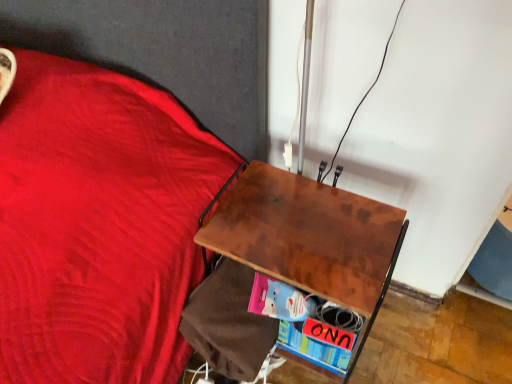
Question: From the image's perspective, is brown wood desk at center located beneath multicolored cardboard book at lower right?

Choices:
 (A) no
 (B) yes

Answer: (A)

Question: From a real-world perspective, is brown wood desk at center under multicolored cardboard book at lower right?

Choices:
 (A) yes
 (B) no

Answer: (B)

Question: From a real-world perspective, is brown wood desk at center positioned over multicolored cardboard book at lower right based on gravity?

Choices:
 (A) yes
 (B) no

Answer: (A)

Question: Can you confirm if brown wood desk at center is smaller than multicolored cardboard book at lower right?

Choices:
 (A) yes
 (B) no

Answer: (B)

Question: Is brown wood desk at center not inside multicolored cardboard book at lower right?

Choices:
 (A) yes
 (B) no

Answer: (A)

Question: From the image's perspective, is brown wood desk at center over multicolored cardboard book at lower right?

Choices:
 (A) yes
 (B) no

Answer: (A)

Question: Is multicolored cardboard book at lower right smaller than brown wood desk at center?

Choices:
 (A) yes
 (B) no

Answer: (A)

Question: From a real-world perspective, is multicolored cardboard book at lower right on top of brown wood desk at center?

Choices:
 (A) no
 (B) yes

Answer: (A)

Question: Is multicolored cardboard book at lower right wider than brown wood desk at center?

Choices:
 (A) no
 (B) yes

Answer: (A)

Question: From the image's perspective, is multicolored cardboard book at lower right over brown wood desk at center?

Choices:
 (A) yes
 (B) no

Answer: (B)

Question: Is multicolored cardboard book at lower right oriented away from brown wood desk at center?

Choices:
 (A) yes
 (B) no

Answer: (A)

Question: Is multicolored cardboard book at lower right outside brown wood desk at center?

Choices:
 (A) no
 (B) yes

Answer: (A)

Question: From the image's perspective, is multicolored cardboard book at lower right above or below brown wood desk at center?

Choices:
 (A) below
 (B) above

Answer: (A)